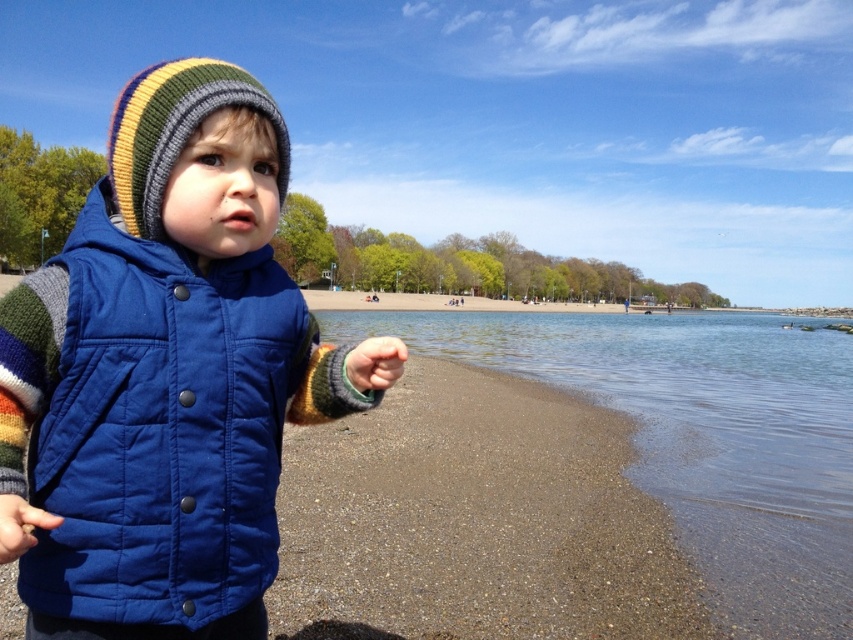
Which is above, clear water at lower right or green fuzzy glove at lower left?

green fuzzy glove at lower left is higher up.

Does clear water at lower right come behind green fuzzy glove at lower left?

Yes, it is behind green fuzzy glove at lower left.

Between point (809, 452) and point (375, 358), which one is positioned behind?

Point (809, 452)

Locate an element on the screen. clear water at lower right is located at coordinates (700, 436).

Between clear water at lower right and blue quilted vest at lower left, which one has more height?

With more height is clear water at lower right.

Who is more forward, (723,406) or (21,540)?

Point (21,540) is in front.

Identify the location of clear water at lower right. tap(700, 436).

Does knitted woolen hat at upper left have a smaller size compared to green fuzzy glove at lower left?

Actually, knitted woolen hat at upper left might be larger than green fuzzy glove at lower left.

Who is lower down, knitted woolen hat at upper left or green fuzzy glove at lower left?

Positioned lower is green fuzzy glove at lower left.

Is point (262, 88) closer to camera compared to point (374, 346)?

No, it is not.

Locate an element on the screen. The width and height of the screenshot is (853, 640). knitted woolen hat at upper left is located at coordinates (175, 131).